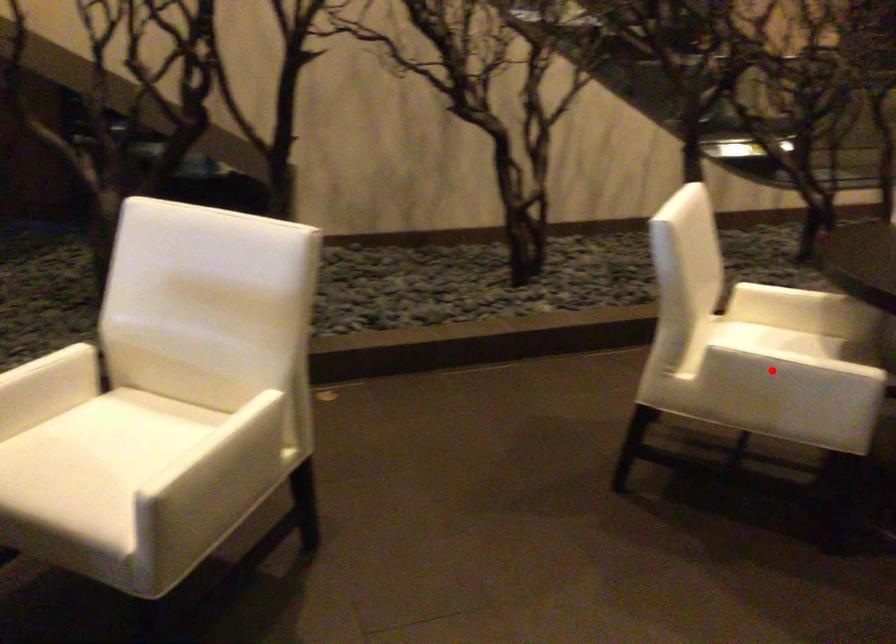
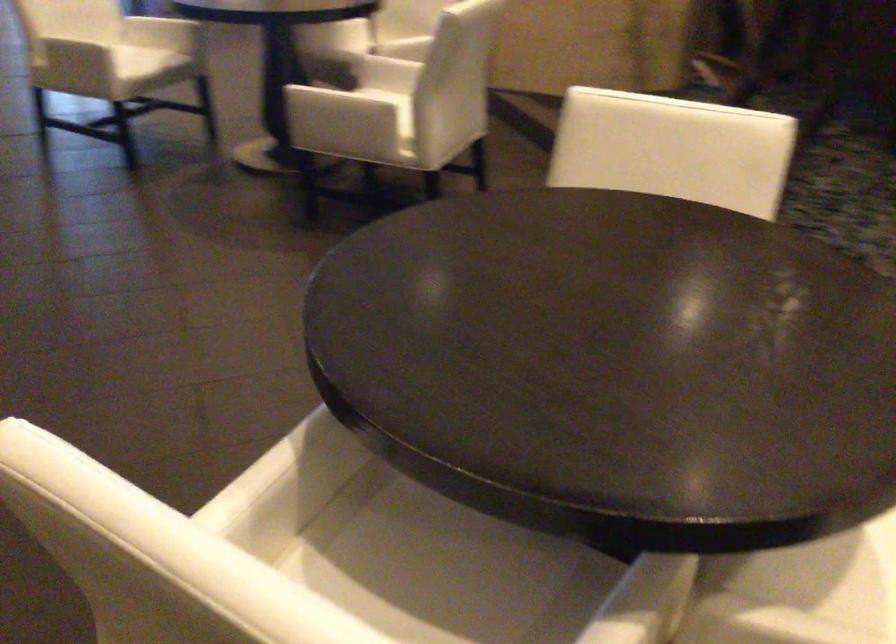
Question: I am providing you with two images of the same scene from different viewpoints. A red point is marked on the first image. At the location where the point appears in image 1, is it still visible in image 2?

Choices:
 (A) Yes
 (B) No

Answer: (B)